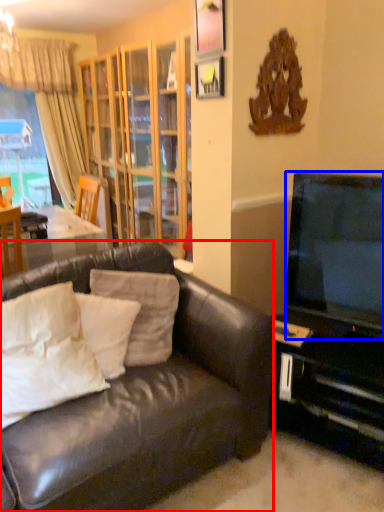
Question: Which point is further to the camera, studio couch (highlighted by a red box) or television (highlighted by a blue box)?

Choices:
 (A) studio couch
 (B) television

Answer: (B)